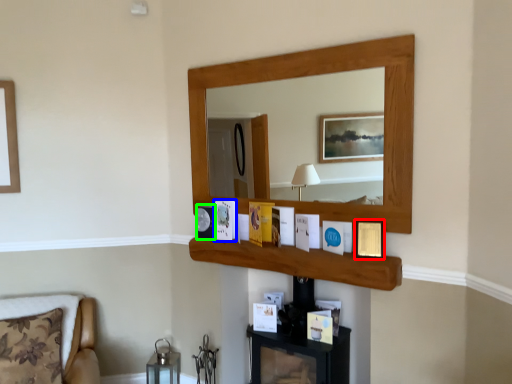
Question: Which object is positioned farthest from picture frame (highlighted by a red box)? Select from picture frame (highlighted by a blue box) and picture frame (highlighted by a green box).

Choices:
 (A) picture frame
 (B) picture frame

Answer: (B)